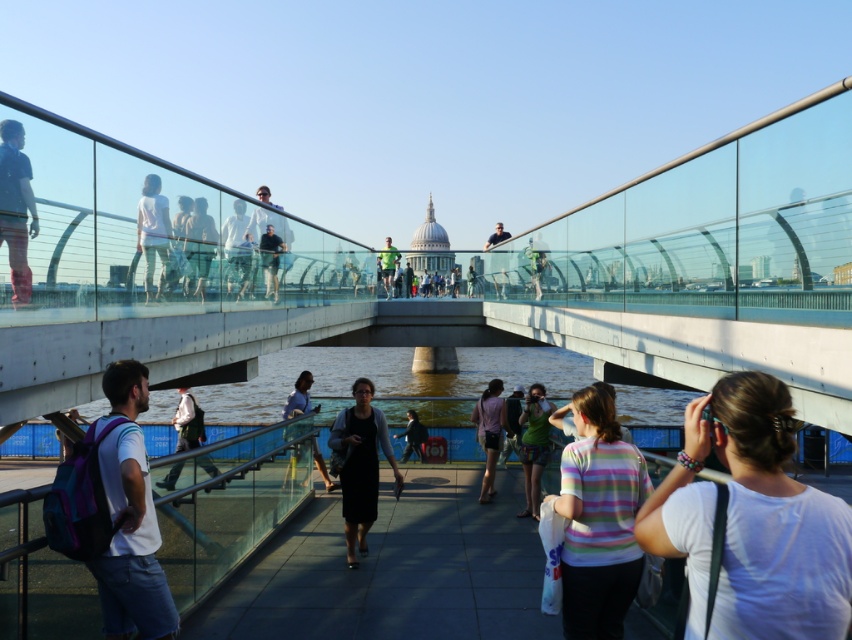
Question: Can you confirm if white fabric at center is positioned below striped cotton shirt at lower right?

Choices:
 (A) yes
 (B) no

Answer: (B)

Question: Among these objects, which one is farthest from the camera?

Choices:
 (A) dark blue jacket at center
 (B) white matte shirt at upper center
 (C) green fabric shirt at center
 (D) light brown leather backpack at lower left

Answer: (C)

Question: Estimate the real-world distances between objects in this image. Which object is closer to the green fabric dress at center?

Choices:
 (A) dark blue jacket at center
 (B) white fabric at center
 (C) dark blue jeans at center
 (D) dark blue shirt at upper center

Answer: (A)

Question: Does striped cotton shirt at lower right come behind dark blue shirt at upper center?

Choices:
 (A) no
 (B) yes

Answer: (A)

Question: Does light blue shirt at upper center lie in front of pink fabric dress at center?

Choices:
 (A) no
 (B) yes

Answer: (B)

Question: Which object appears closest to the camera in this image?

Choices:
 (A) transparent glass pedestrian bridge at center
 (B) white fabric at center
 (C) green fabric shirt at center
 (D) smooth concrete pavement at center

Answer: (B)